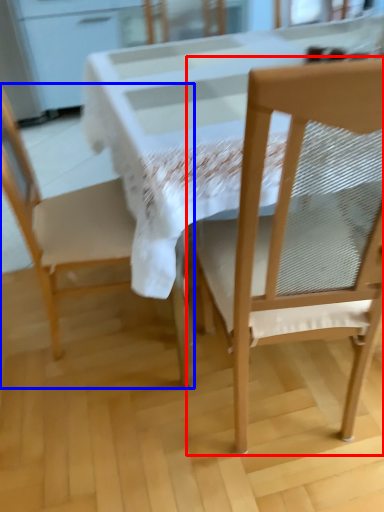
Question: Among these objects, which one is farthest to the camera, chair (highlighted by a red box) or chair (highlighted by a blue box)?

Choices:
 (A) chair
 (B) chair

Answer: (B)